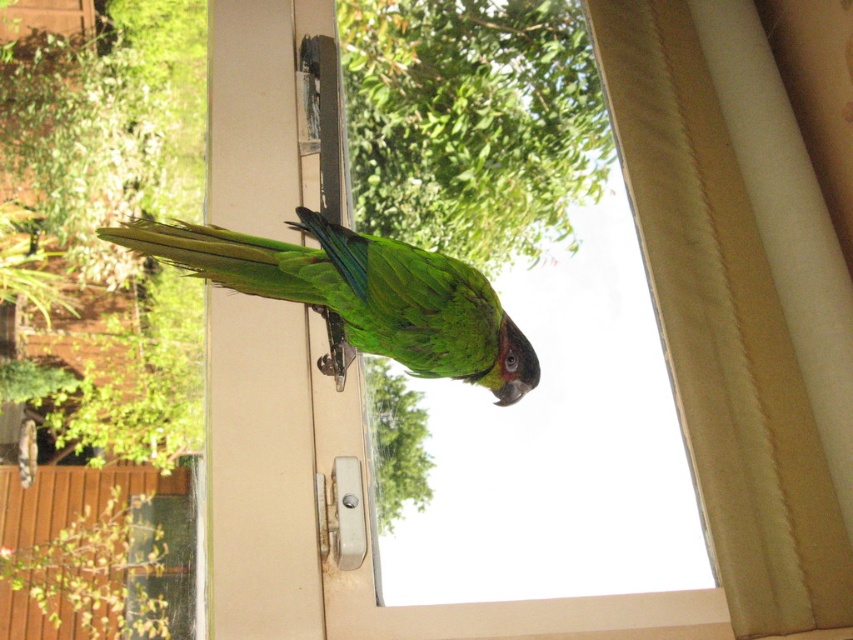
Question: Does transparent glass window at center appear on the left side of beige textured curtain at upper right?

Choices:
 (A) yes
 (B) no

Answer: (A)

Question: Does transparent glass window at center lie in front of green matte parrot at center?

Choices:
 (A) yes
 (B) no

Answer: (B)

Question: Which point is farther from the camera taking this photo?

Choices:
 (A) (445, 573)
 (B) (376, 289)
 (C) (711, 236)

Answer: (C)

Question: Which of the following is the farthest from the observer?

Choices:
 (A) (409, 352)
 (B) (488, 102)
 (C) (728, 593)

Answer: (B)

Question: Does beige textured curtain at upper right have a smaller size compared to green matte parrot at center?

Choices:
 (A) no
 (B) yes

Answer: (A)

Question: Among these objects, which one is nearest to the camera?

Choices:
 (A) beige textured curtain at upper right
 (B) green matte parrot at center
 (C) transparent glass window at center

Answer: (B)